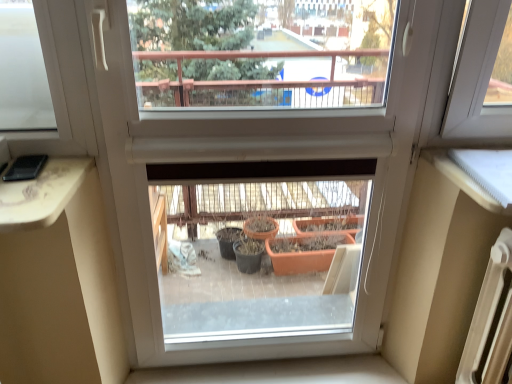
In order to click on white plastic radiator at right in this screenshot , I will do `click(490, 321)`.

Describe the element at coordinates (490, 321) in the screenshot. I see `white plastic radiator at right` at that location.

Locate an element on the screen. The width and height of the screenshot is (512, 384). white plastic radiator at right is located at coordinates (490, 321).